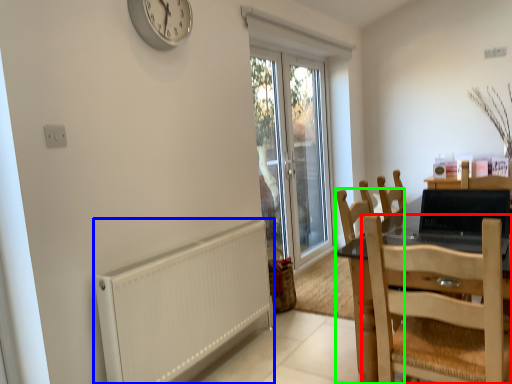
Question: Which object is the farthest from chair (highlighted by a red box)? Choose among these: radiator (highlighted by a blue box) or chair (highlighted by a green box).

Choices:
 (A) radiator
 (B) chair

Answer: (A)